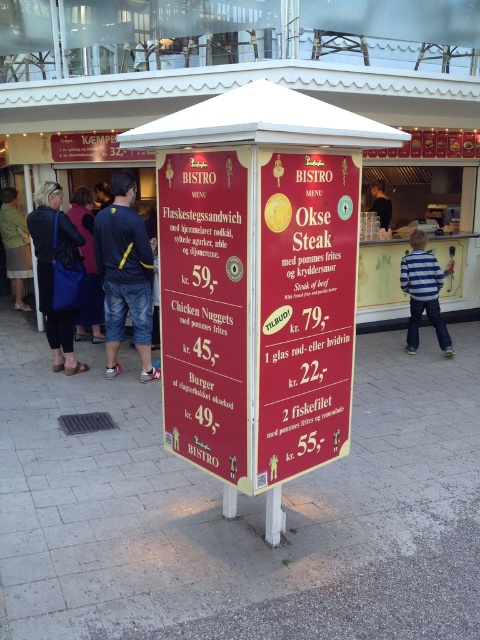
You are a tourist in Denmark and want to order a burger from the food stall. The menu board is located at point (257, 308). Can you tell me the price of the burger listed on the red glossy menu board at center?

The Burger is listed for kr. 49 on the red glossy menu board at center.

You are a customer standing in front of the food stall. You notice the red glossy menu board at center and the striped cotton shirt at right. Which object is taller?

The red glossy menu board at center is taller than the striped cotton shirt at right.